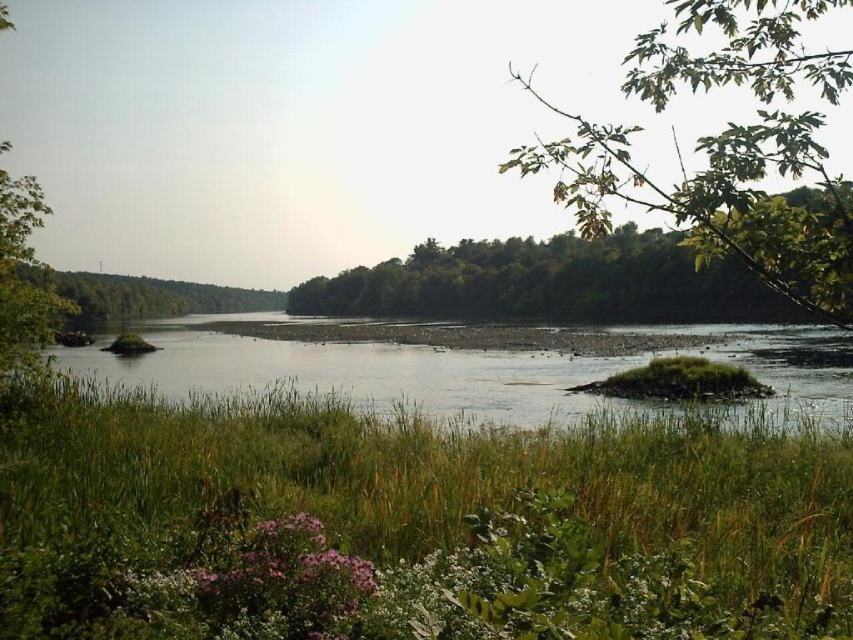
From the picture: You are standing at the edge of the river and want to walk towards the green leafy branch at upper right. Which direction should you head from the green grassy patch at lower center?

You should head to the right from the green grassy patch at lower center to reach the green leafy branch at upper right since the green grassy patch at lower center is located to the left of the green leafy branch at upper right.

In the scene shown: You are a hiker trying to cross the river. You see the green grassy river at center and the green leafy tree at center. Which one is larger in size?

The green leafy tree at center is larger in size compared to the green grassy river at center.